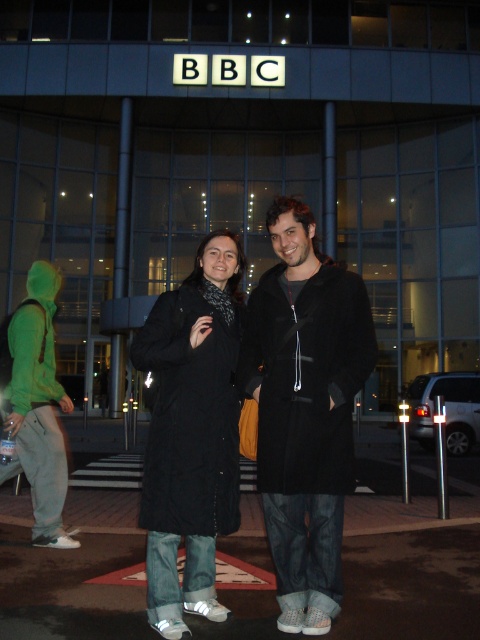
Question: Can you confirm if black matte coat at center is positioned below green hoodie at left?

Choices:
 (A) no
 (B) yes

Answer: (A)

Question: Does black matte coat at center appear on the right side of green hoodie at left?

Choices:
 (A) yes
 (B) no

Answer: (A)

Question: Which object is positioned farthest from the black matte coat at center?

Choices:
 (A) green hoodie at left
 (B) black wool coat at center

Answer: (A)

Question: Which point is closer to the camera?

Choices:
 (A) black wool coat at center
 (B) black matte coat at center
 (C) green hoodie at left

Answer: (B)

Question: Among these objects, which one is farthest from the camera?

Choices:
 (A) black matte coat at center
 (B) black wool coat at center

Answer: (B)

Question: Is black wool coat at center positioned behind green hoodie at left?

Choices:
 (A) yes
 (B) no

Answer: (B)